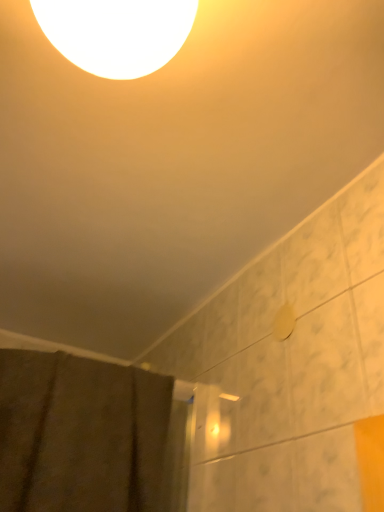
Question: From a real-world perspective, is white glossy light at upper center physically located above or below brown textured fabric at lower left?

Choices:
 (A) below
 (B) above

Answer: (B)

Question: Is white glossy light at upper center inside or outside of brown textured fabric at lower left?

Choices:
 (A) inside
 (B) outside

Answer: (B)

Question: In terms of size, does white glossy light at upper center appear bigger or smaller than brown textured fabric at lower left?

Choices:
 (A) small
 (B) big

Answer: (A)

Question: In terms of size, does brown textured fabric at lower left appear bigger or smaller than white glossy light at upper center?

Choices:
 (A) small
 (B) big

Answer: (B)

Question: From a real-world perspective, is brown textured fabric at lower left physically located above or below white glossy light at upper center?

Choices:
 (A) below
 (B) above

Answer: (A)

Question: Relative to white glossy light at upper center, is brown textured fabric at lower left in front or behind?

Choices:
 (A) front
 (B) behind

Answer: (B)

Question: Considering the positions of brown textured fabric at lower left and white glossy light at upper center in the image, is brown textured fabric at lower left taller or shorter than white glossy light at upper center?

Choices:
 (A) tall
 (B) short

Answer: (A)